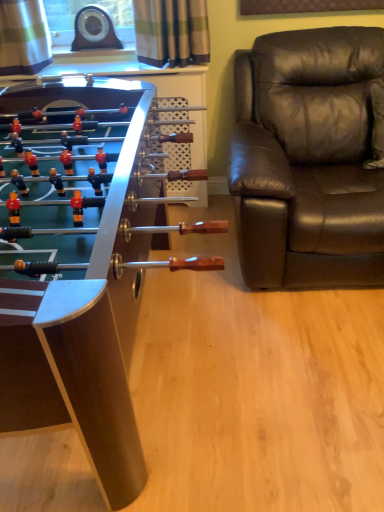
Question: Choose the correct answer: Is metallic foosball table at left inside brown leather chair at right or outside it?

Choices:
 (A) inside
 (B) outside

Answer: (B)

Question: Is metallic foosball table at left taller or shorter than brown leather chair at right?

Choices:
 (A) short
 (B) tall

Answer: (A)

Question: Would you say metallic foosball table at left is to the left or to the right of brown leather chair at right in the picture?

Choices:
 (A) right
 (B) left

Answer: (B)

Question: From their relative heights in the image, would you say brown leather chair at right is taller or shorter than metallic foosball table at left?

Choices:
 (A) tall
 (B) short

Answer: (A)

Question: In terms of size, does brown leather chair at right appear bigger or smaller than metallic foosball table at left?

Choices:
 (A) small
 (B) big

Answer: (A)

Question: Would you say brown leather chair at right is inside or outside metallic foosball table at left?

Choices:
 (A) outside
 (B) inside

Answer: (A)

Question: From the image's perspective, is brown leather chair at right positioned above or below metallic foosball table at left?

Choices:
 (A) above
 (B) below

Answer: (A)